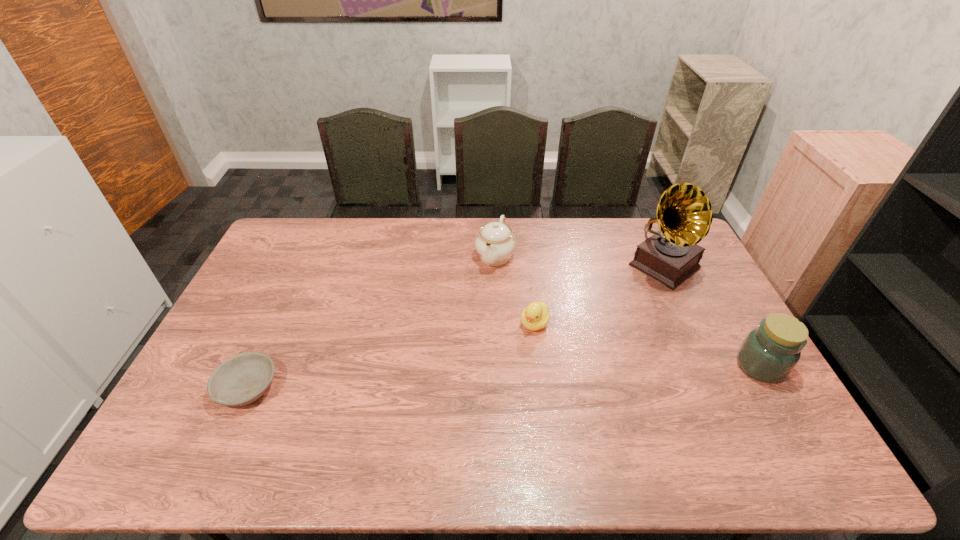
Locate an element on the screen. The height and width of the screenshot is (540, 960). free location located 0.310m at the spout of the chinaware is located at coordinates (462, 341).

Locate an element on the screen. The height and width of the screenshot is (540, 960). vacant space located at the spout of the chinaware is located at coordinates (468, 326).

Locate an element on the screen. This screenshot has height=540, width=960. vacant region located 0.310m on the beak of the duckling is located at coordinates (474, 411).

This screenshot has width=960, height=540. Find the location of `vacant space positioned 0.050m on the beak of the duckling`. vacant space positioned 0.050m on the beak of the duckling is located at coordinates click(520, 345).

I want to click on vacant space situated on the beak of the duckling, so click(486, 394).

I want to click on vacant area situated 0.070m from the horn of the phonograph record, so click(x=632, y=292).

Locate an element on the screen. free space located 0.060m from the horn of the phonograph record is located at coordinates (634, 290).

Find the location of a particular element. The width and height of the screenshot is (960, 540). blank space located 0.150m from the horn of the phonograph record is located at coordinates (617, 302).

You are a GUI agent. You are given a task and a screenshot of the screen. Output one action in this format:
    pyautogui.click(x=<x>, y=<y>)
    Task: Click on the chinaware positioned at the far edge
    This screenshot has width=960, height=540.
    Given the screenshot: What is the action you would take?
    pyautogui.click(x=495, y=243)

Where is `phonograph record that is at the far edge`? phonograph record that is at the far edge is located at coordinates (671, 255).